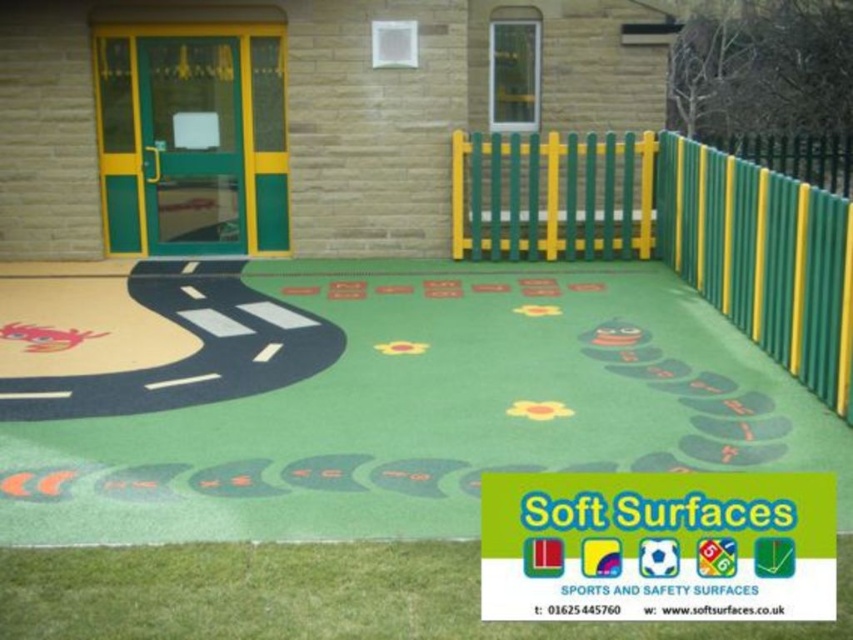
You are standing at the entrance of the play area and want to place a new toy box exactly at the center of the green rubber mat at center. According to the coordinates provided, where should you position the toy box?

The green rubber mat at center is located at coordinates point (366, 396), so you should position the toy box at point (366, 396) to place it exactly at the center of the green rubber mat at center.

You are a parent trying to ensure your child stays within the safe play area. The play area has a green rubber mat at center and a green plastic fence at center. Which object should you tell your child to stay behind to ensure safety?

The green plastic fence at center is the boundary, so you should tell your child to stay behind the green plastic fence at center to ensure safety since it is above the green rubber mat at center and likely encloses the play area.

You are a parent setting up a play area for your child. You have a green rubber mat at center and a green plastic fence at center. Which object takes up more space in the play area?

The green plastic fence at center takes up more space than the green rubber mat at center because the green rubber mat at center occupies less space than the green plastic fence at center.